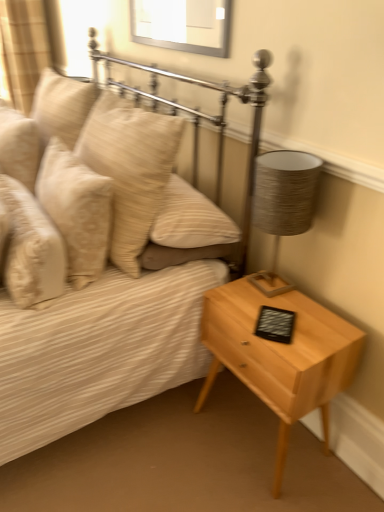
Question: Choose the correct answer: Is textured gray lampshade at right inside matte beige bed at center or outside it?

Choices:
 (A) outside
 (B) inside

Answer: (A)

Question: Based on their positions, is textured gray lampshade at right located to the left or right of matte beige bed at center?

Choices:
 (A) right
 (B) left

Answer: (A)

Question: Estimate the real-world distances between objects in this image. Which object is farther from the beige textured pillow at left, which is the 3th pillow in right-to-left order?

Choices:
 (A) beige textured pillow at left, which ranks as the 3th pillow in left-to-right order
 (B) beige textured pillow at left, which is the fourth pillow in right-to-left order
 (C) light wood/texture nightstand at lower right
 (D) beige fabric curtain at upper left
 (E) textured gray lampshade at right

Answer: (D)

Question: Which object is positioned farthest from the beige textured pillow at left, which ranks as the 3th pillow in left-to-right order?

Choices:
 (A) beige textured pillow at left, which is the fourth pillow in right-to-left order
 (B) light wood/texture nightstand at lower right
 (C) beige fabric curtain at upper left
 (D) beige textured pillow at left, which is the 3th pillow in right-to-left order
 (E) beige textured pillow at upper left, the first pillow in the right-to-left sequence

Answer: (C)